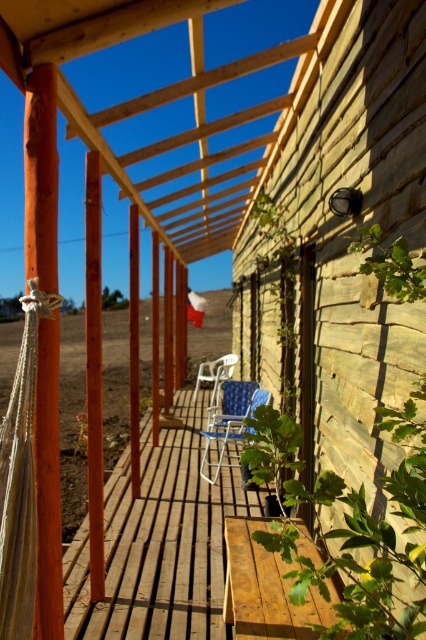
Question: Observing the image, what is the correct spatial positioning of blue woven chair at center in reference to white plastic chair at center?

Choices:
 (A) right
 (B) left

Answer: (B)

Question: Can you confirm if blue woven chair at center is positioned above white plastic chair at center?

Choices:
 (A) yes
 (B) no

Answer: (B)

Question: Among these points, which one is nearest to the camera?

Choices:
 (A) (218, 380)
 (B) (203, 432)

Answer: (B)

Question: Which object is closer to the camera taking this photo?

Choices:
 (A) white plastic chair at center
 (B) blue woven chair at center

Answer: (B)

Question: Does blue woven chair at center have a greater width compared to white plastic chair at center?

Choices:
 (A) no
 (B) yes

Answer: (B)